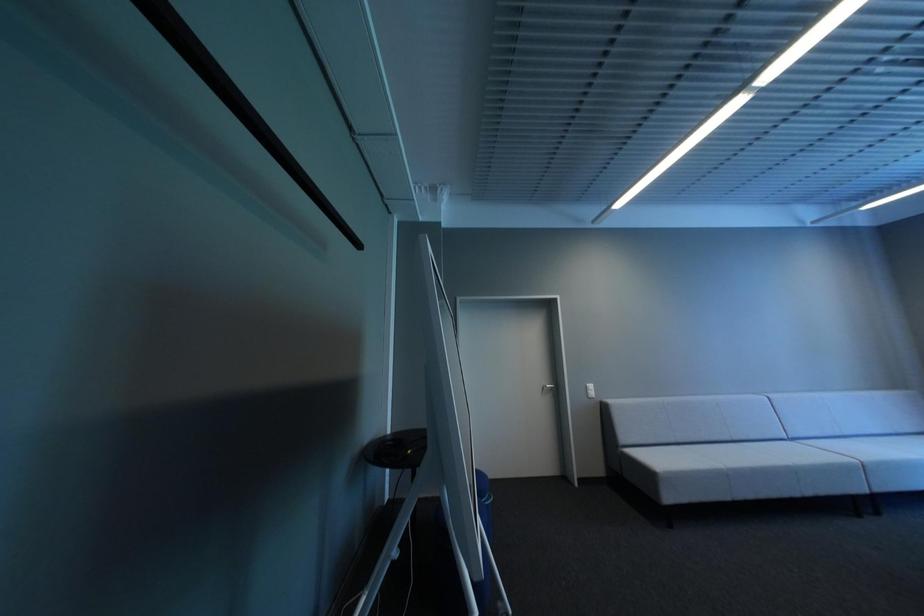
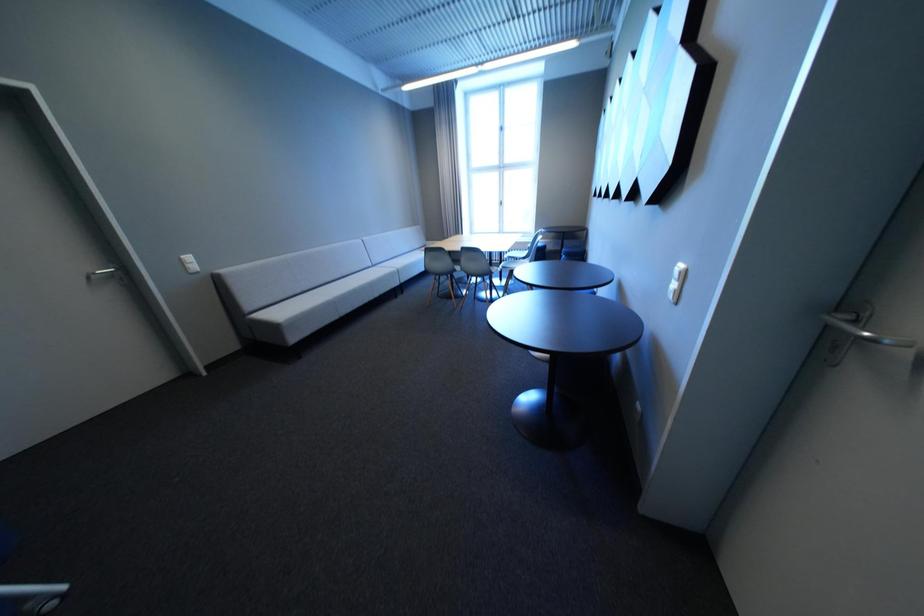
How did the camera likely rotate?

The camera's rotation is toward right-down.